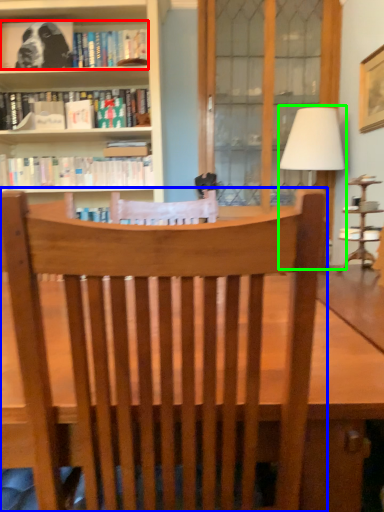
Question: Considering the real-world distances, which object is closest to book (highlighted by a red box)? chair (highlighted by a blue box) or table lamp (highlighted by a green box).

Choices:
 (A) chair
 (B) table lamp

Answer: (B)